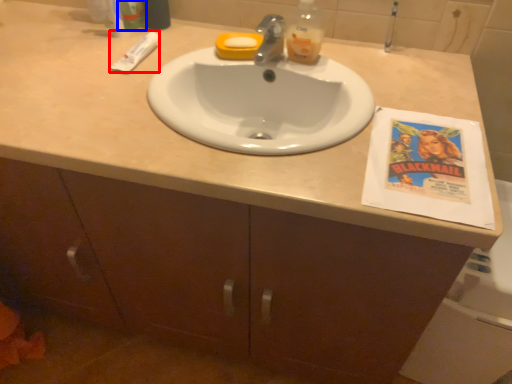
Question: Which point is further to the camera, toothpaste (highlighted by a red box) or toiletry (highlighted by a blue box)?

Choices:
 (A) toothpaste
 (B) toiletry

Answer: (B)